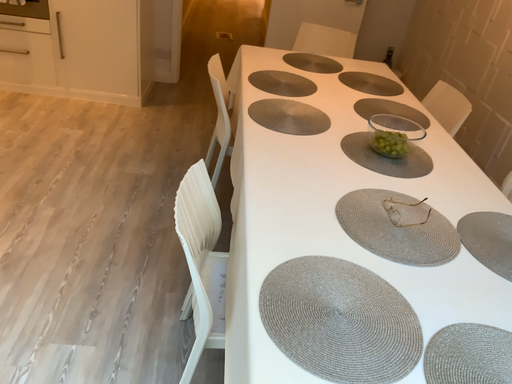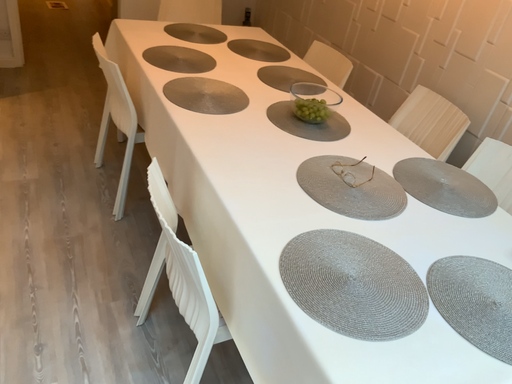
Question: Which way did the camera rotate in the video?

Choices:
 (A) rotated left
 (B) rotated right

Answer: (B)